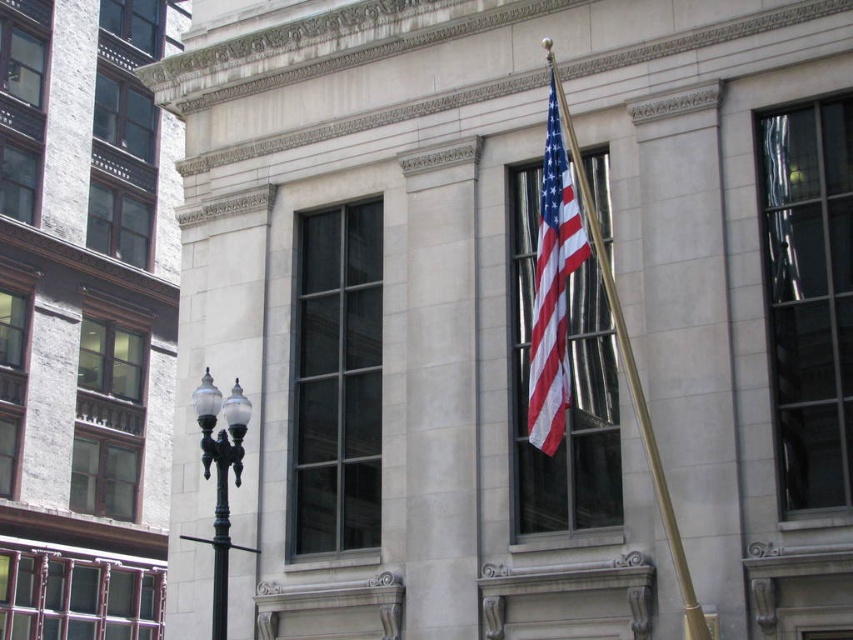
Based on the photo, which is below, american flag at center or gold polished flag pole at center?

gold polished flag pole at center is below.

Is american flag at center wider than gold polished flag pole at center?

No.

This screenshot has width=853, height=640. I want to click on american flag at center, so click(x=553, y=284).

Find the location of `american flag at center`. american flag at center is located at coordinates (553, 284).

Does american flag at center appear over polished black lamppost at lower left?

Correct, american flag at center is located above polished black lamppost at lower left.

The image size is (853, 640). I want to click on american flag at center, so click(x=553, y=284).

Can you confirm if gold polished flag pole at center is bigger than polished black lamppost at lower left?

Yes.

Who is more distant from viewer, (695,625) or (225,605)?

Point (225,605)

Between point (596, 225) and point (231, 444), which one is positioned behind?

Positioned behind is point (231, 444).

Identify the location of gold polished flag pole at center. (630, 371).